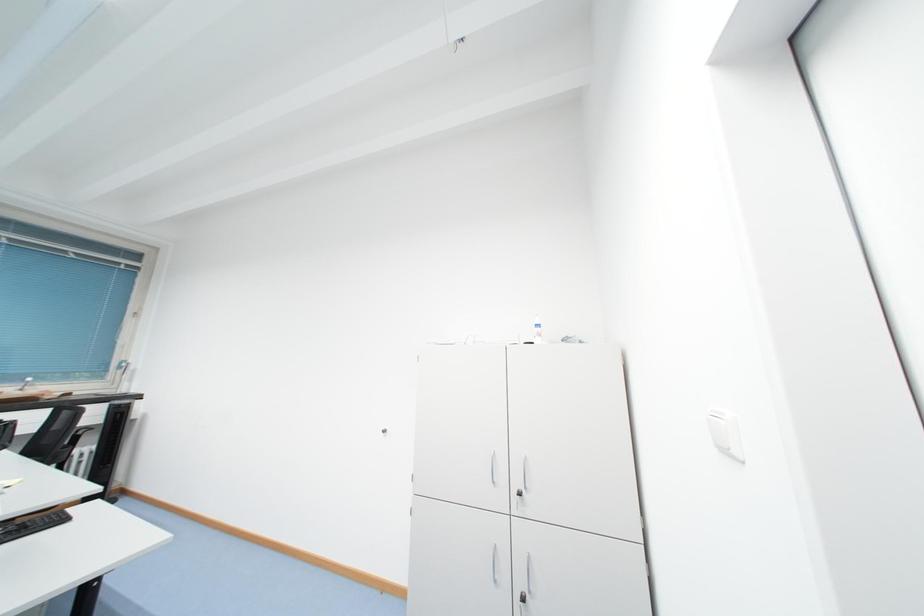
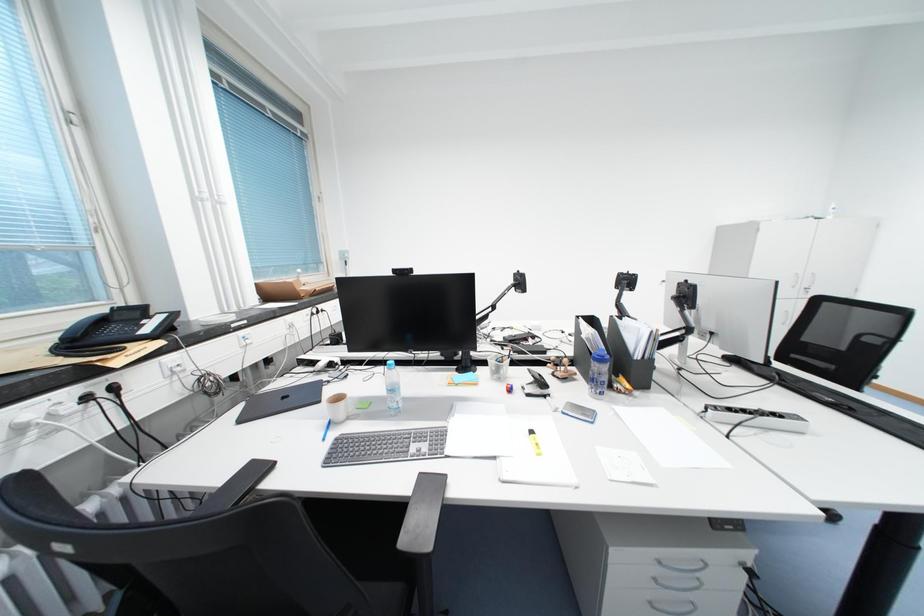
Question: What movement of the cameraman would produce the second image?

Choices:
 (A) Left
 (B) Right
 (C) Forward
 (D) Backward

Answer: (A)